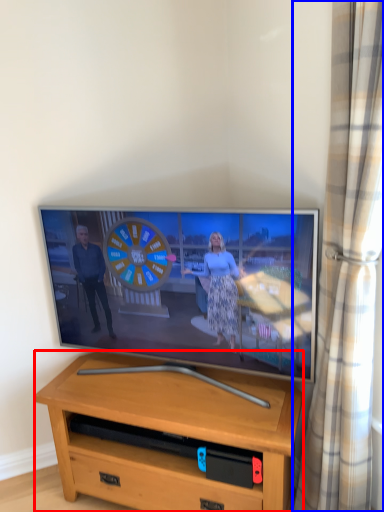
Question: Which object appears farthest to the camera in this image, desk (highlighted by a red box) or curtain (highlighted by a blue box)?

Choices:
 (A) desk
 (B) curtain

Answer: (A)